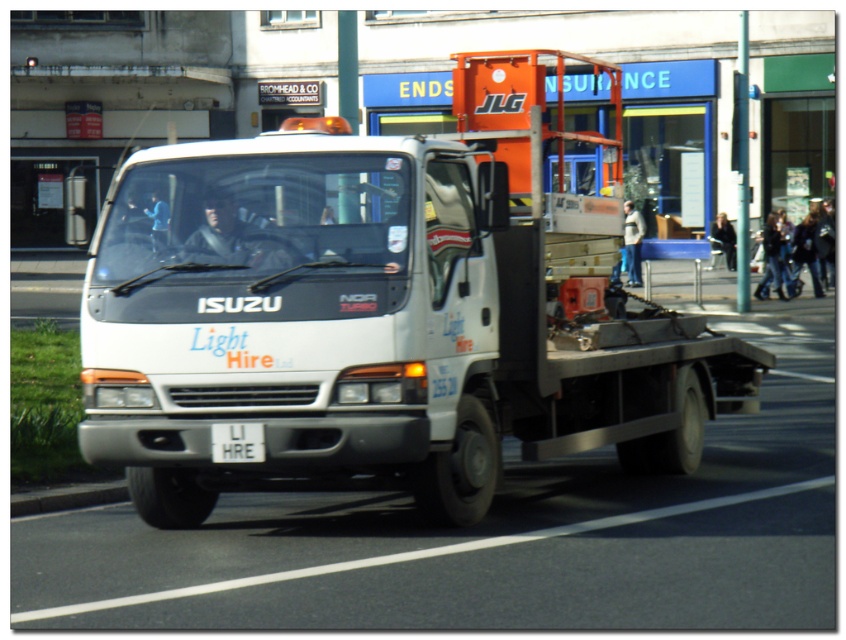
Is white metallic truck at center to the left of white plastic license plate at center from the viewer's perspective?

In fact, white metallic truck at center is to the right of white plastic license plate at center.

Identify the location of white metallic truck at center. (378, 312).

You are a GUI agent. You are given a task and a screenshot of the screen. Output one action in this format:
    pyautogui.click(x=<x>, y=<y>)
    Task: Click on the white metallic truck at center
    The width and height of the screenshot is (846, 640).
    Given the screenshot: What is the action you would take?
    pyautogui.click(x=378, y=312)